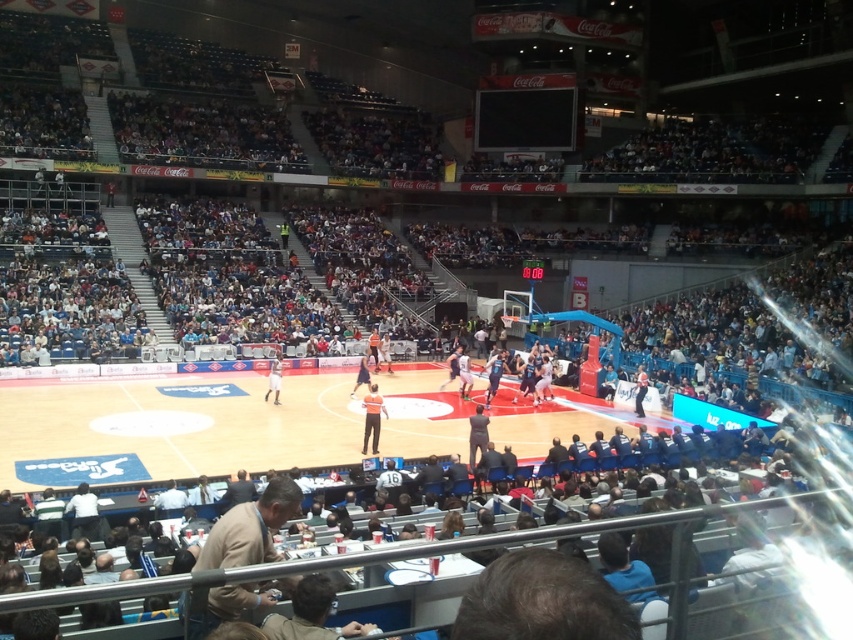
You are a drone operator trying to capture aerial footage of the basketball game. You have two points marked on your screen, point 1 at coordinates point (543, 445) and point 2 at coordinates point (360, 368). If you want to film the action closest to the audience, which point should you focus on?

Point (543, 445) is closer to the viewer than point (360, 368), so you should focus on point (543, 445) to capture the action closest to the audience.

You are a basketball player standing on the wooden basketball court at center. You want to pick up the smooth black basketball at center. Can you reach it without moving your feet?

The wooden basketball court at center is 5.12 meters away from the smooth black basketball at center. Since the distance is too far to reach without moving, you cannot pick it up without moving your feet.

You are a photographer positioned at the arena entrance and want to capture a photo of the wooden basketball court at center and the tan leather jacket at lower left. Based on their positions, which object will appear larger in your photo?

The wooden basketball court at center will appear larger in the photo because it is closer to the photographer than the tan leather jacket at lower left, making it appear bigger due to its proximity.